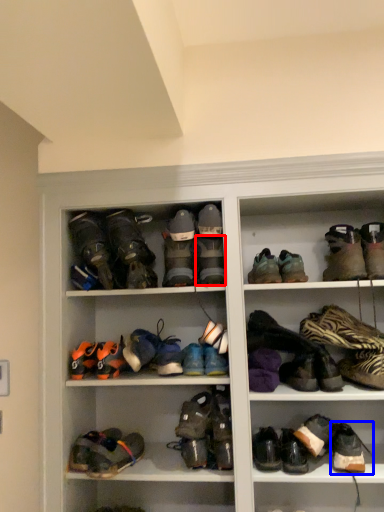
Question: Which point is closer to the camera, footwear (highlighted by a red box) or footwear (highlighted by a blue box)?

Choices:
 (A) footwear
 (B) footwear

Answer: (B)